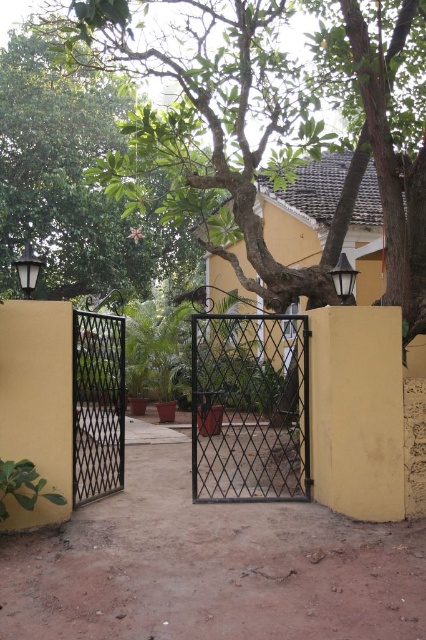
You are standing at the entrance of the yellow wall with a black metal gate. There is a point marked at coordinates (278, 120). What object is located at that point?

The point at coordinates (278, 120) indicates a green leafy tree at center.

You are standing at the yellow wall with the black metal gate. You notice two points marked on the ground. One is at point (129, 36) and the other at point (278, 349). Which point is closer to you as you face the gate?

Point (129, 36) is in front of point (278, 349), so when facing the gate, point (129, 36) is closer to you.

You are a delivery person trying to enter through the gates. The black wrought iron gate at center and the black metal gate at left are both open slightly. Which gate should you choose to pass through if you need to carry a large package that requires more space?

You should choose the black wrought iron gate at center because its width surpasses that of the black metal gate at left, providing more space for your large package.